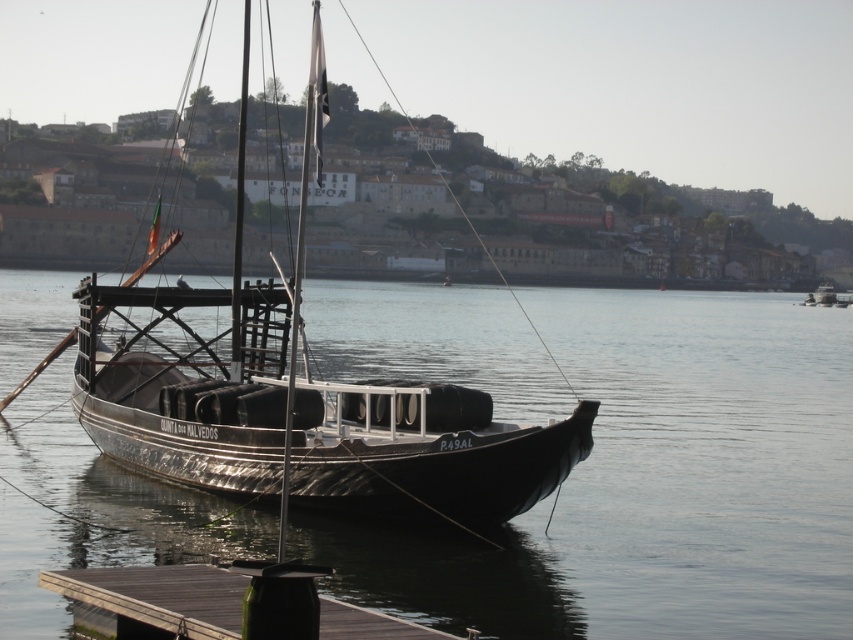
Question: Is black smooth water at center behind wooden sailboat at center?

Choices:
 (A) yes
 (B) no

Answer: (B)

Question: Which object is positioned closest to the black smooth water at center?

Choices:
 (A) wooden sailboat at center
 (B) wooden dock at lower left

Answer: (A)

Question: Which point is farther to the camera?

Choices:
 (A) black smooth water at center
 (B) wooden sailboat at center

Answer: (B)

Question: Which point appears closest to the camera in this image?

Choices:
 (A) tap(300, 460)
 (B) tap(30, 522)

Answer: (A)

Question: Is wooden sailboat at center below wooden dock at lower left?

Choices:
 (A) yes
 (B) no

Answer: (B)

Question: Can you confirm if black smooth water at center is positioned to the left of wooden dock at lower left?

Choices:
 (A) yes
 (B) no

Answer: (B)